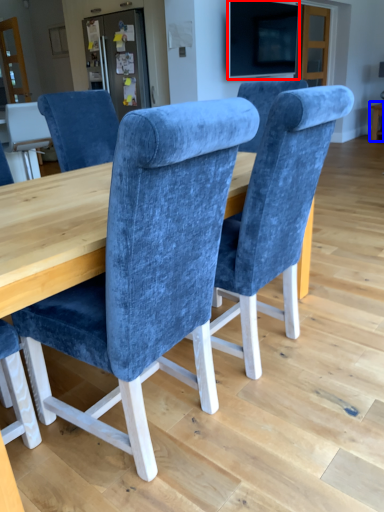
Question: Among these objects, which one is nearest to the camera, television (highlighted by a red box) or table (highlighted by a blue box)?

Choices:
 (A) television
 (B) table

Answer: (A)